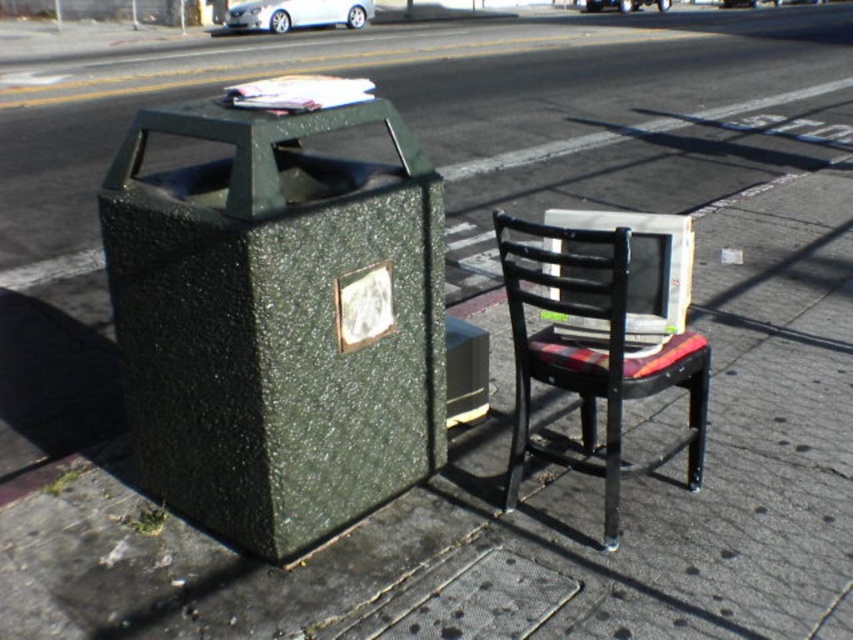
You are a street cleaner standing in front of the green speckled trash can at left and the plaid fabric chair at center. You need to pick up a paper that is lying on the ground between them. Which object is nearer to you so you can reach it first?

The green speckled trash can at left is closer to the viewer than the plaid fabric chair at center, so you can reach it first.

You are standing on the sidewalk and notice a point marked at coordinates (x=277, y=321). Based on the scene, what object is located at that point?

The point at coordinates (x=277, y=321) marks the green speckled trash can at left.